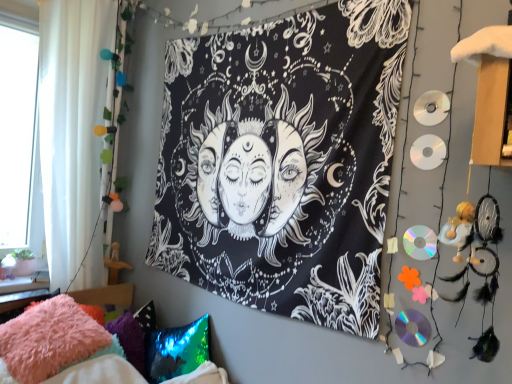
Question: From a real-world perspective, is fluffy pink pillow at lower left, which is the first pillow in left-to-right order, located beneath white sheer curtain at left?

Choices:
 (A) yes
 (B) no

Answer: (A)

Question: Is fluffy pink pillow at lower left, which is the first pillow in left-to-right order, looking in the opposite direction of white sheer curtain at left?

Choices:
 (A) yes
 (B) no

Answer: (B)

Question: Does fluffy pink pillow at lower left, which is the first pillow in left-to-right order, have a lesser width compared to white sheer curtain at left?

Choices:
 (A) yes
 (B) no

Answer: (B)

Question: Is fluffy pink pillow at lower left, which is the first pillow in left-to-right order, shorter than white sheer curtain at left?

Choices:
 (A) yes
 (B) no

Answer: (A)

Question: Does fluffy pink pillow at lower left, which is the first pillow in left-to-right order, have a greater width compared to white sheer curtain at left?

Choices:
 (A) no
 (B) yes

Answer: (B)

Question: Considering the positions of point (40, 153) and point (61, 367), is point (40, 153) closer or farther from the camera than point (61, 367)?

Choices:
 (A) closer
 (B) farther

Answer: (B)

Question: From the image's perspective, relative to fuzzy pink pillow at lower left, is white sheer curtain at left above or below?

Choices:
 (A) below
 (B) above

Answer: (B)

Question: Visually, is white sheer curtain at left positioned to the left or to the right of fuzzy pink pillow at lower left?

Choices:
 (A) left
 (B) right

Answer: (A)

Question: Is white sheer curtain at left taller or shorter than fuzzy pink pillow at lower left?

Choices:
 (A) short
 (B) tall

Answer: (B)

Question: Does point (186, 339) appear closer or farther from the camera than point (55, 79)?

Choices:
 (A) closer
 (B) farther

Answer: (A)

Question: Considering their positions, is holographic sequin pillow at lower left, the 1th pillow when ordered from right to left, located in front of or behind white sheer curtain at left?

Choices:
 (A) behind
 (B) front

Answer: (B)

Question: From a real-world perspective, relative to white sheer curtain at left, is holographic sequin pillow at lower left, the 1th pillow when ordered from right to left, vertically above or below?

Choices:
 (A) below
 (B) above

Answer: (A)

Question: Looking at their shapes, would you say holographic sequin pillow at lower left, the 1th pillow when ordered from right to left, is wider or thinner than white sheer curtain at left?

Choices:
 (A) wide
 (B) thin

Answer: (A)

Question: Is holographic sequin pillow at lower left, the 1th pillow when ordered from right to left, taller or shorter than black fabric tapestry at center?

Choices:
 (A) tall
 (B) short

Answer: (B)

Question: From a real-world perspective, relative to black fabric tapestry at center, is holographic sequin pillow at lower left, the 1th pillow when ordered from right to left, vertically above or below?

Choices:
 (A) below
 (B) above

Answer: (A)